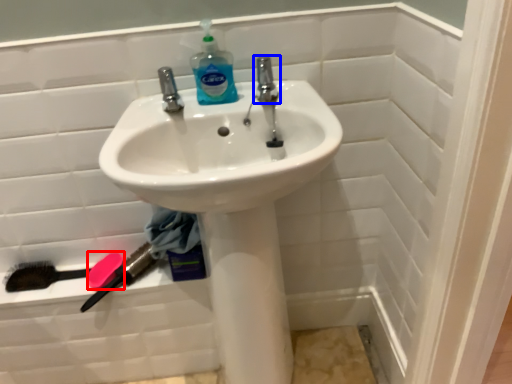
Question: Among these objects, which one is nearest to the camera, soap (highlighted by a red box) or tap (highlighted by a blue box)?

Choices:
 (A) soap
 (B) tap

Answer: (B)